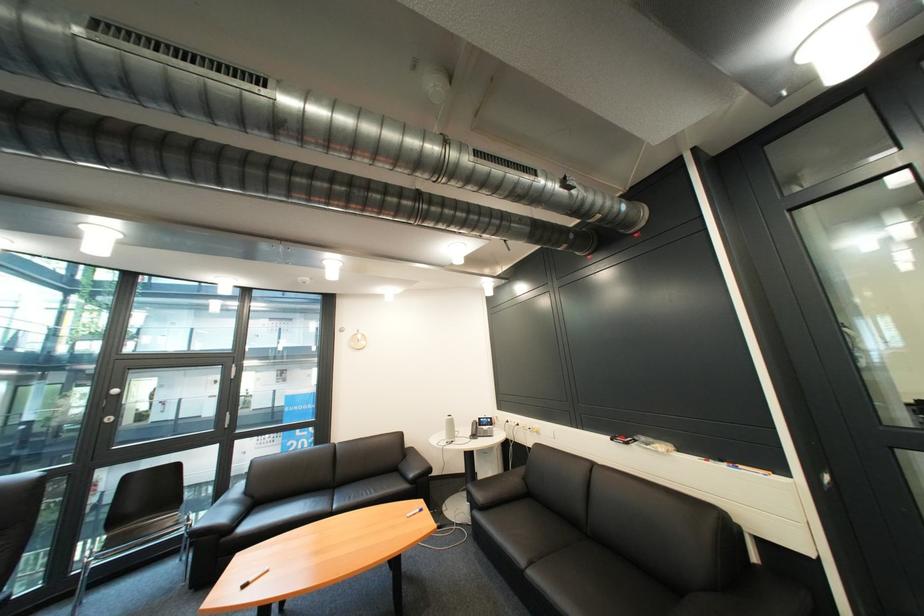
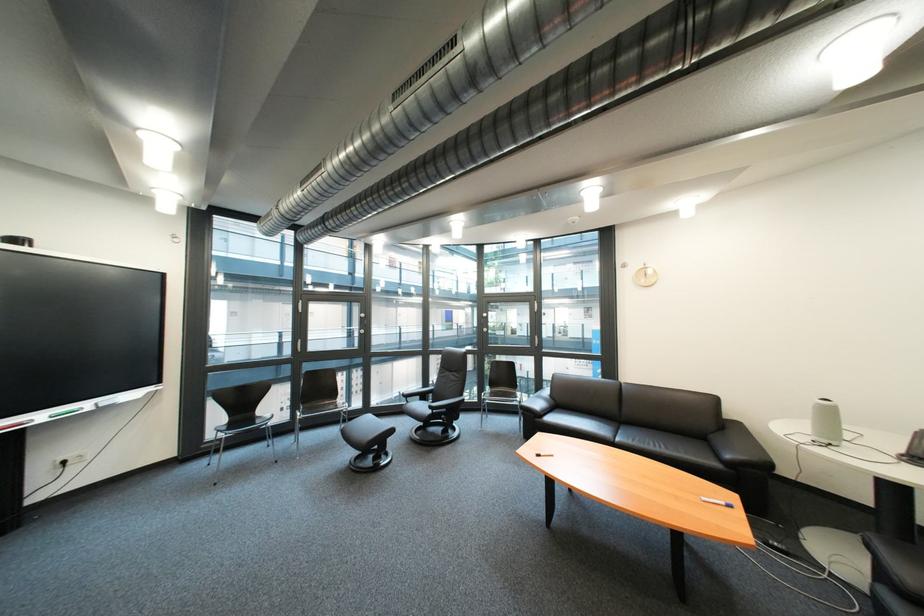
Where in the second image is the point corresponding to (x=424, y=477) from the first image?

(742, 458)